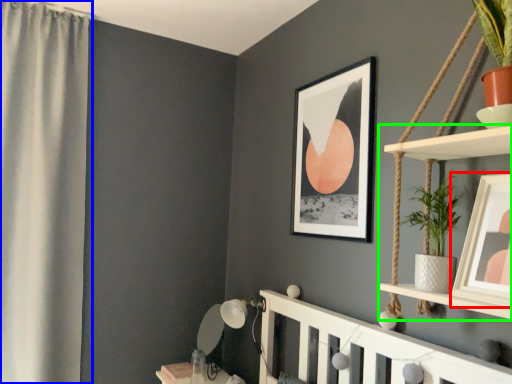
Question: Estimate the real-world distances between objects in this image. Which object is closer to picture frame (highlighted by a red box), curtain (highlighted by a blue box) or shelf (highlighted by a green box)?

Choices:
 (A) curtain
 (B) shelf

Answer: (B)